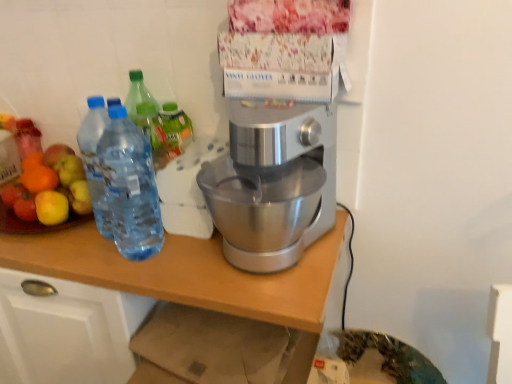
Question: Is silver metallic stand mixer at center placed right next to silver metallic table at center?

Choices:
 (A) no
 (B) yes

Answer: (A)

Question: Is silver metallic stand mixer at center located outside silver metallic table at center?

Choices:
 (A) yes
 (B) no

Answer: (A)

Question: From the image's perspective, is silver metallic stand mixer at center located beneath silver metallic table at center?

Choices:
 (A) no
 (B) yes

Answer: (A)

Question: Considering the relative sizes of silver metallic stand mixer at center and silver metallic table at center in the image provided, is silver metallic stand mixer at center thinner than silver metallic table at center?

Choices:
 (A) yes
 (B) no

Answer: (A)

Question: Can silver metallic table at center be found inside silver metallic stand mixer at center?

Choices:
 (A) no
 (B) yes

Answer: (A)

Question: In terms of size, does silver metallic stand mixer at center appear bigger or smaller than transparent plastic bottles at left?

Choices:
 (A) big
 (B) small

Answer: (A)

Question: Considering the positions of point (284, 244) and point (135, 213), is point (284, 244) closer or farther from the camera than point (135, 213)?

Choices:
 (A) closer
 (B) farther

Answer: (A)

Question: Is silver metallic stand mixer at center taller or shorter than transparent plastic bottles at left?

Choices:
 (A) tall
 (B) short

Answer: (B)

Question: From a real-world perspective, is silver metallic stand mixer at center above or below transparent plastic bottles at left?

Choices:
 (A) below
 (B) above

Answer: (A)

Question: Considering the positions of point (143, 172) and point (306, 312), is point (143, 172) closer or farther from the camera than point (306, 312)?

Choices:
 (A) farther
 (B) closer

Answer: (A)

Question: Considering the positions of transparent plastic bottles at left and silver metallic table at center in the image, is transparent plastic bottles at left wider or thinner than silver metallic table at center?

Choices:
 (A) wide
 (B) thin

Answer: (B)

Question: Which is correct: transparent plastic bottles at left is inside silver metallic table at center, or outside of it?

Choices:
 (A) inside
 (B) outside

Answer: (B)

Question: Is transparent plastic bottles at left in front of or behind silver metallic table at center in the image?

Choices:
 (A) front
 (B) behind

Answer: (B)

Question: Considering the relative positions of shiny plastic fruit salad at left and silver metallic table at center in the image provided, is shiny plastic fruit salad at left to the left or to the right of silver metallic table at center?

Choices:
 (A) right
 (B) left

Answer: (B)

Question: Is shiny plastic fruit salad at left taller or shorter than silver metallic table at center?

Choices:
 (A) tall
 (B) short

Answer: (B)